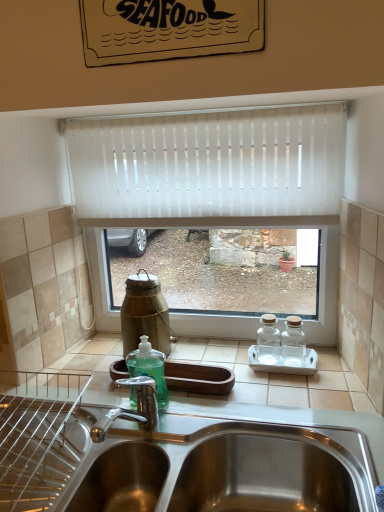
What do you see at coordinates (213, 182) in the screenshot? I see `white vertical blinds at center` at bounding box center [213, 182].

In order to click on stainless steel sink at lower center in this screenshot , I will do `click(169, 456)`.

What are the coordinates of `white vertical blinds at center` in the screenshot? It's located at (213, 182).

Is green glass bottle at center oriented away from stainless steel sink at lower center?

No.

Is the depth of green glass bottle at center greater than that of stainless steel sink at lower center?

That is True.

From a real-world perspective, which object rests below the other?

stainless steel sink at lower center.

Is green glass bottle at center surrounding stainless steel sink at lower center?

That's incorrect, stainless steel sink at lower center is not inside green glass bottle at center.

Which of these two, white vertical blinds at center or stainless steel sink at lower center, is thinner?

white vertical blinds at center is thinner.

Considering the relative positions of white vertical blinds at center and stainless steel sink at lower center in the image provided, is white vertical blinds at center to the right of stainless steel sink at lower center from the viewer's perspective?

Yes, white vertical blinds at center is to the right of stainless steel sink at lower center.

Consider the image. From their relative heights in the image, would you say white vertical blinds at center is taller or shorter than stainless steel sink at lower center?

white vertical blinds at center is taller than stainless steel sink at lower center.

Is white vertical blinds at center positioned with its back to stainless steel sink at lower center?

No.

What's the angular difference between white vertical blinds at center and green glass bottle at center's facing directions?

There is a 0.418-degree angle between the facing directions of white vertical blinds at center and green glass bottle at center.

Is white vertical blinds at center wider or thinner than green glass bottle at center?

white vertical blinds at center is thinner than green glass bottle at center.

Is white vertical blinds at center looking in the opposite direction of green glass bottle at center?

No, white vertical blinds at center is not facing away from green glass bottle at center.

Looking at this image, from the image's perspective, is white vertical blinds at center positioned above or below green glass bottle at center?

Clearly, from the image's perspective, white vertical blinds at center is above green glass bottle at center.

What's the angular difference between stainless steel sink at lower center and green glass bottle at center's facing directions?

0.435 degrees.

In the scene shown: From the image's perspective, is stainless steel sink at lower center located above or below green glass bottle at center?

stainless steel sink at lower center is below green glass bottle at center.

Which object is wider, stainless steel sink at lower center or green glass bottle at center?

stainless steel sink at lower center is wider.

Is stainless steel sink at lower center completely or partially outside of green glass bottle at center?

Absolutely, stainless steel sink at lower center is external to green glass bottle at center.

Considering the sizes of objects stainless steel sink at lower center and white vertical blinds at center in the image provided, who is smaller, stainless steel sink at lower center or white vertical blinds at center?

white vertical blinds at center.

Considering the positions of point (324, 495) and point (323, 291), is point (324, 495) closer or farther from the camera than point (323, 291)?

Point (324, 495) is closer to the camera than point (323, 291).

Between stainless steel sink at lower center and white vertical blinds at center, which one has more height?

With more height is white vertical blinds at center.

Based on the photo, could white vertical blinds at center be considered to be inside green glass bottle at center?

Actually, white vertical blinds at center is outside green glass bottle at center.

From the image's perspective, does green glass bottle at center appear lower than white vertical blinds at center?

Indeed, from the image's perspective, green glass bottle at center is shown beneath white vertical blinds at center.

Is green glass bottle at center facing away from white vertical blinds at center?

No, green glass bottle at center is not facing the opposite direction of white vertical blinds at center.

At what (x,y) coordinates should I click in order to perform the action: click on bottle on the left side of white vertical blinds at center. Please return your answer as a coordinate pair (x, y). Looking at the image, I should click on coord(145,313).

Where is `bottle on the left of stainless steel sink at lower center`? The image size is (384, 512). bottle on the left of stainless steel sink at lower center is located at coordinates (145, 313).

Locate an element on the screen. window above the stainless steel sink at lower center (from the image's perspective) is located at coordinates click(x=213, y=182).

When comparing their distances from stainless steel sink at lower center, does green glass bottle at center or white vertical blinds at center seem closer?

The object closer to stainless steel sink at lower center is green glass bottle at center.

Considering their positions, is white vertical blinds at center positioned further to stainless steel sink at lower center than green glass bottle at center?

white vertical blinds at center lies further to stainless steel sink at lower center than the other object.

Which object lies nearer to the anchor point green glass bottle at center, stainless steel sink at lower center or white vertical blinds at center?

white vertical blinds at center lies closer to green glass bottle at center than the other object.

Considering their positions, is white vertical blinds at center positioned closer to green glass bottle at center than stainless steel sink at lower center?

white vertical blinds at center is positioned closer to the anchor green glass bottle at center.

When comparing their distances from white vertical blinds at center, does green glass bottle at center or stainless steel sink at lower center seem closer?

green glass bottle at center.

Considering their positions, is stainless steel sink at lower center positioned further to white vertical blinds at center than green glass bottle at center?

stainless steel sink at lower center.

The height and width of the screenshot is (512, 384). Find the location of `bottle between white vertical blinds at center and stainless steel sink at lower center from top to bottom`. bottle between white vertical blinds at center and stainless steel sink at lower center from top to bottom is located at coordinates (145, 313).